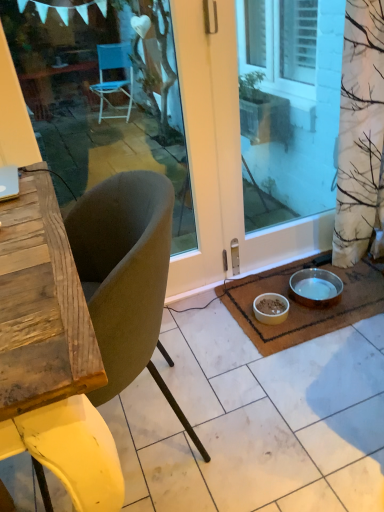
Locate an element on the screen. The height and width of the screenshot is (512, 384). free point behind metallic silver bowl at lower right, the first bowl viewed from the right is located at coordinates (305, 266).